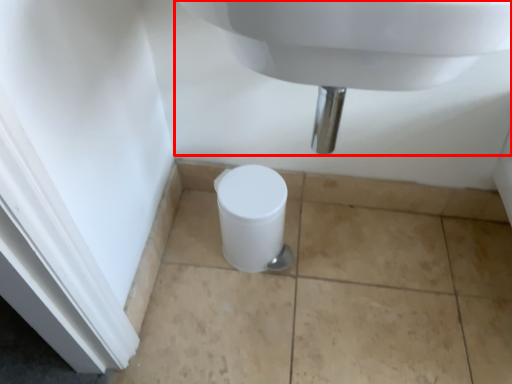
Question: From the image, what is the correct spatial relationship of sink (annotated by the red box) in relation to toilet?

Choices:
 (A) left
 (B) right

Answer: (B)